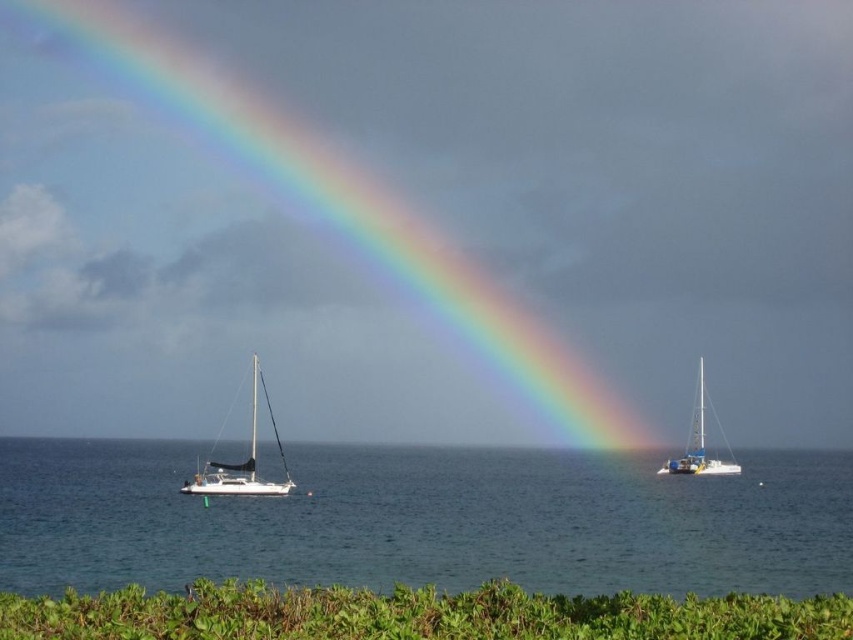
Based on the photo, is rainbow at upper center shorter than blue metallic sailboat at right?

No.

Which is in front, point (560, 200) or point (697, 404)?

Point (697, 404) is more forward.

Does point (234, 285) come closer to viewer compared to point (703, 401)?

No.

You are a GUI agent. You are given a task and a screenshot of the screen. Output one action in this format:
    pyautogui.click(x=<x>, y=<y>)
    Task: Click on the rainbow at upper center
    The width and height of the screenshot is (853, 640).
    Given the screenshot: What is the action you would take?
    pyautogui.click(x=308, y=212)

Where is `white glossy sailboat at center`? This screenshot has width=853, height=640. white glossy sailboat at center is located at coordinates (242, 461).

Between rainbow at upper center and white glossy sailboat at center, which one appears on the right side from the viewer's perspective?

Positioned to the right is white glossy sailboat at center.

I want to click on rainbow at upper center, so click(308, 212).

What do you see at coordinates (308, 212) in the screenshot? This screenshot has width=853, height=640. I see `rainbow at upper center` at bounding box center [308, 212].

Image resolution: width=853 pixels, height=640 pixels. What are the coordinates of `rainbow at upper center` in the screenshot? It's located at (308, 212).